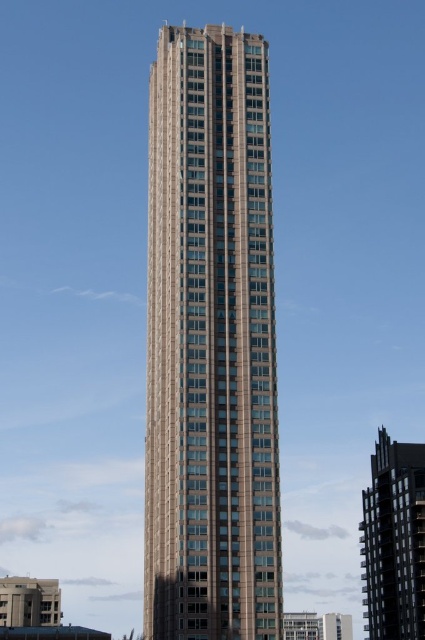
You are standing at the base of the skyscraper and want to take a photo of the point at coordinates point (172, 328). If your camera has a maximum zoom range of 100 meters, will you be able to capture the point clearly in your photo?

The point point (172, 328) is 76.45 meters away from the camera. Since the camera can zoom up to 100 meters, you can capture the point clearly.

You are an urban planner analyzing the skyline. You need to determine which building occupies more horizontal space. Based on the image, which building has a wider footprint? Please choose between the brown stone building at center and the dark gray concrete building at lower right.

The dark gray concrete building at lower right has a greater width than the brown stone building at center, so it occupies more horizontal space.

You are a drone operator tasked with flying a drone between the brown stone building at center and the dark gray concrete building at lower right. The drone has a maximum flight range of 120 feet. Can the drone safely fly between these two buildings without exceeding its range?

The distance between the brown stone building at center and the dark gray concrete building at lower right is 119.51 feet, which is within the drone operator s 120 feet maximum flight range. Therefore, the drone can safely fly between them without exceeding its range.